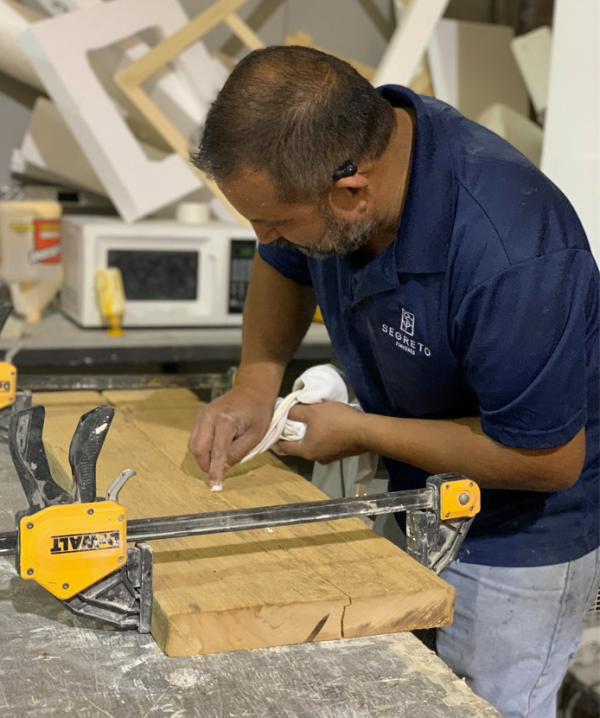
At what (x,y) coordinates should I click in order to perform the action: click on microwave. Please return your answer as a coordinate pair (x, y). The width and height of the screenshot is (600, 718). Looking at the image, I should click on (197, 284).